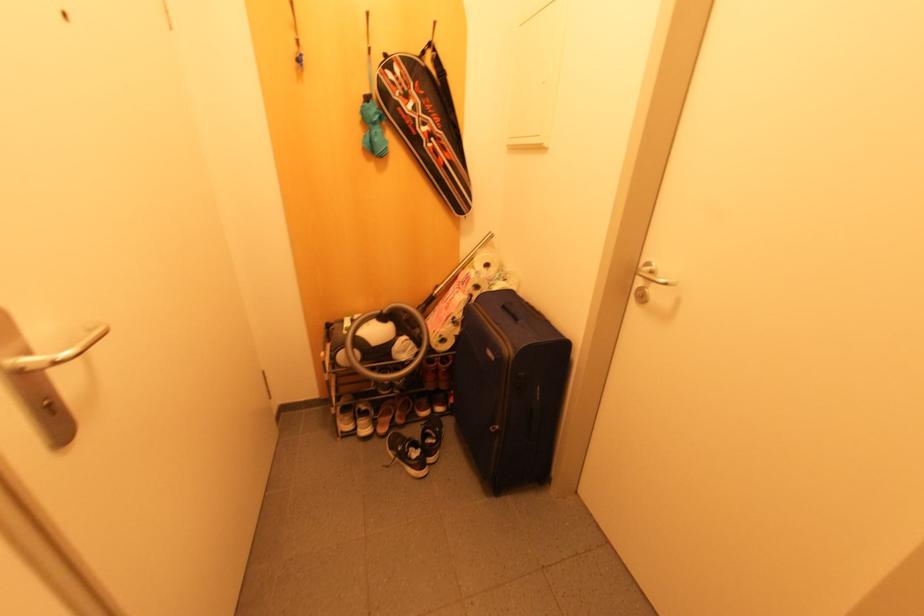
What do you see at coordinates (511, 310) in the screenshot? I see `a blue suitcase handle` at bounding box center [511, 310].